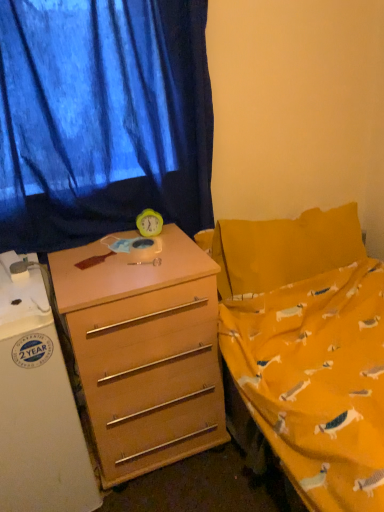
Question: Considering the relative positions of white glossy refrigerator at left and yellow plastic clock at center in the image provided, is white glossy refrigerator at left to the left of yellow plastic clock at center from the viewer's perspective?

Choices:
 (A) no
 (B) yes

Answer: (B)

Question: From the image's perspective, is white glossy refrigerator at left on yellow plastic clock at center?

Choices:
 (A) yes
 (B) no

Answer: (B)

Question: Can you confirm if white glossy refrigerator at left is wider than yellow plastic clock at center?

Choices:
 (A) no
 (B) yes

Answer: (B)

Question: From the image's perspective, would you say white glossy refrigerator at left is shown under yellow plastic clock at center?

Choices:
 (A) no
 (B) yes

Answer: (B)

Question: Considering the relative sizes of white glossy refrigerator at left and yellow plastic clock at center in the image provided, is white glossy refrigerator at left taller than yellow plastic clock at center?

Choices:
 (A) yes
 (B) no

Answer: (A)

Question: Relative to light brown wood desk at center, is blue fabric curtain at upper left in front or behind?

Choices:
 (A) front
 (B) behind

Answer: (B)

Question: In terms of width, does blue fabric curtain at upper left look wider or thinner when compared to light brown wood desk at center?

Choices:
 (A) thin
 (B) wide

Answer: (A)

Question: From a real-world perspective, is blue fabric curtain at upper left physically located above or below light brown wood desk at center?

Choices:
 (A) above
 (B) below

Answer: (A)

Question: In the image, is blue fabric curtain at upper left on the left side or the right side of light brown wood desk at center?

Choices:
 (A) left
 (B) right

Answer: (A)

Question: In the image, is light brown wood desk at center positioned in front of or behind white glossy refrigerator at left?

Choices:
 (A) front
 (B) behind

Answer: (B)

Question: Is light brown wood desk at center taller or shorter than white glossy refrigerator at left?

Choices:
 (A) short
 (B) tall

Answer: (A)

Question: Looking at their shapes, would you say light brown wood desk at center is wider or thinner than white glossy refrigerator at left?

Choices:
 (A) thin
 (B) wide

Answer: (A)

Question: Choose the correct answer: Is light brown wood desk at center inside white glossy refrigerator at left or outside it?

Choices:
 (A) inside
 (B) outside

Answer: (B)

Question: Is yellow plastic clock at center wider or thinner than blue fabric curtain at upper left?

Choices:
 (A) thin
 (B) wide

Answer: (B)

Question: From a real-world perspective, is yellow plastic clock at center above or below blue fabric curtain at upper left?

Choices:
 (A) above
 (B) below

Answer: (B)